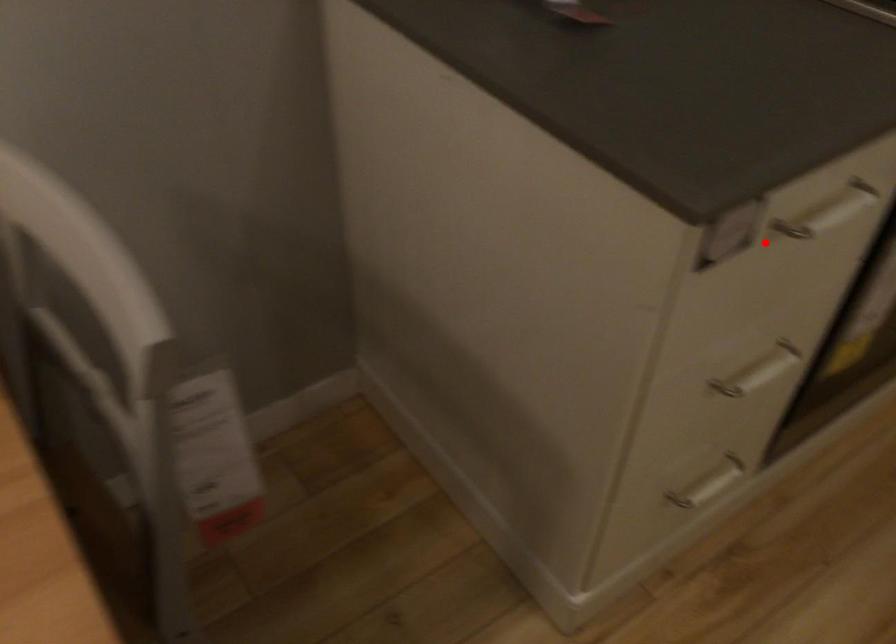
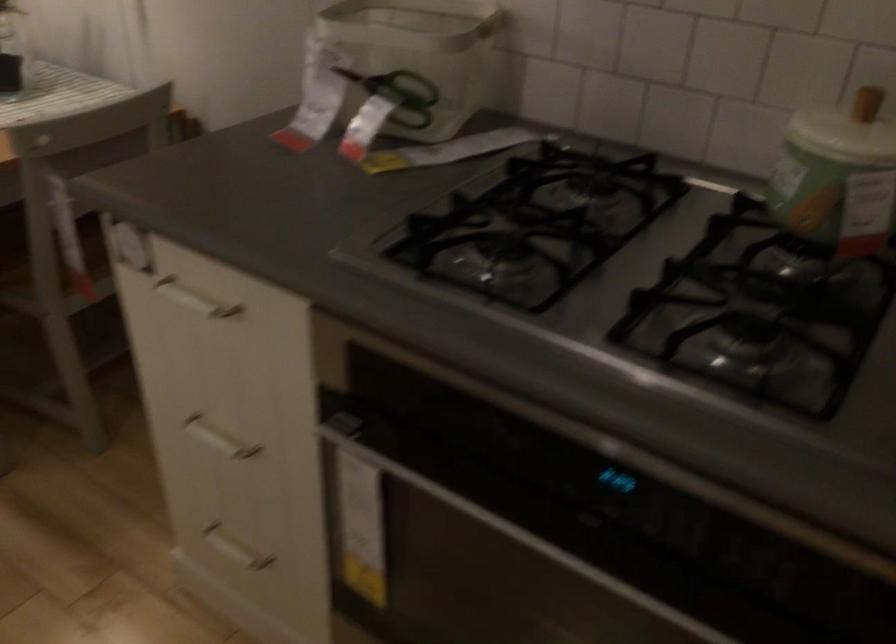
The point at the highlighted location is marked in the first image. Where is the corresponding point in the second image?

(194, 299)